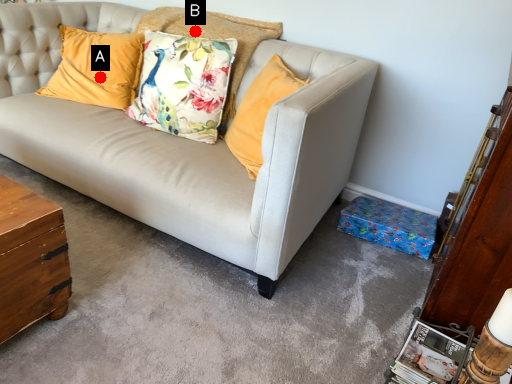
Question: Two points are circled on the image, labeled by A and B beside each circle. Which point is farther from the camera taking this photo?

Choices:
 (A) A is further
 (B) B is further

Answer: (A)